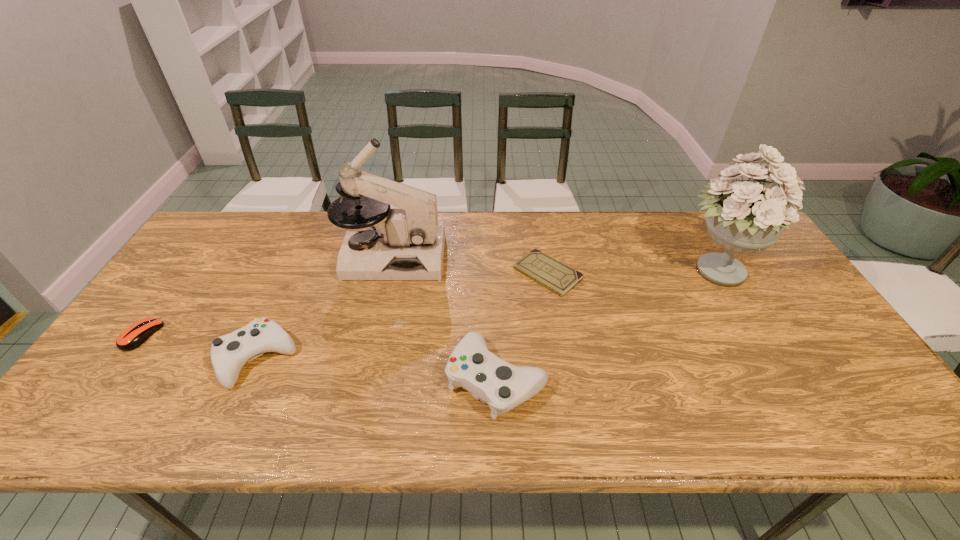
Please point a vacant point for placing a control on the right. Please provide its 2D coordinates. Your answer should be formatted as a tuple, i.e. [(x, y)], where the tuple contains the x and y coordinates of a point satisfying the conditions above.

[(756, 400)]